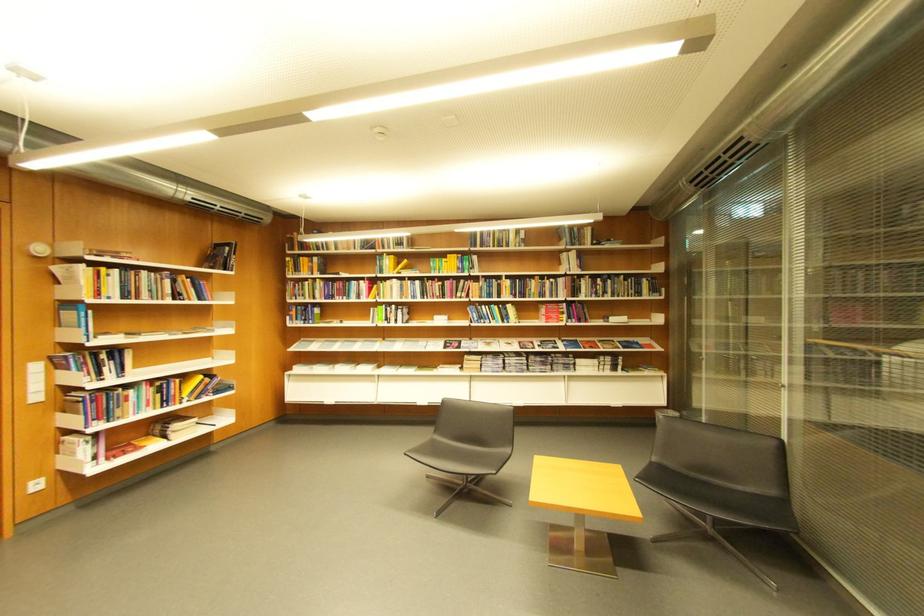
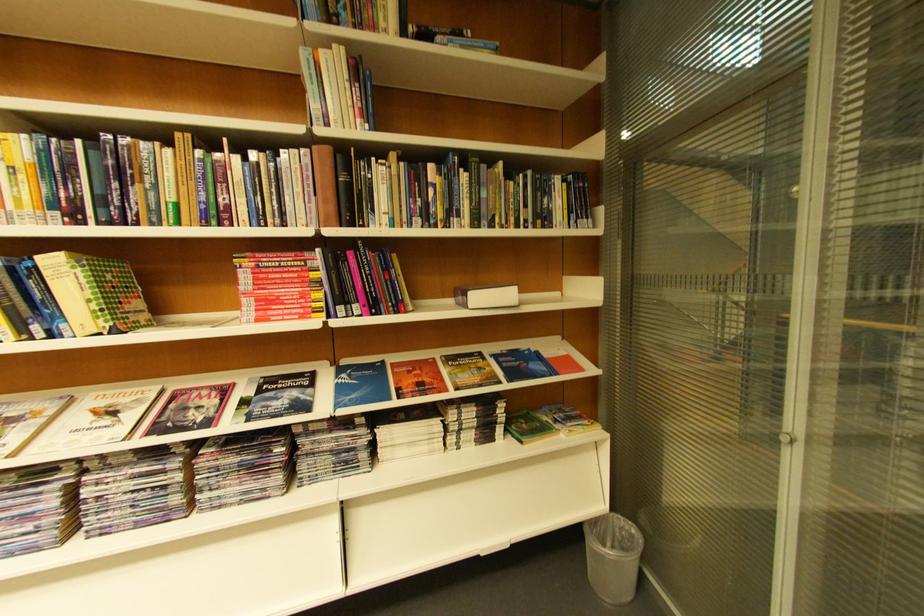
Where in the second image is the point corresponding to point 584,322 from the first image?

(367, 310)